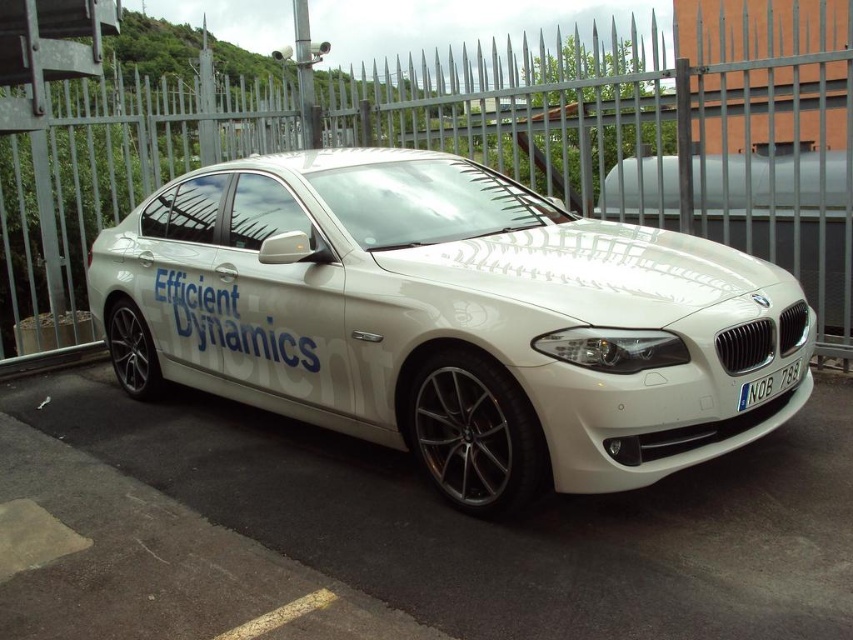
Question: Among these points, which one is nearest to the camera?

Choices:
 (A) (602, 484)
 (B) (781, 218)

Answer: (A)

Question: Is metallic silver fence at center thinner than blue metallic license plate at front?

Choices:
 (A) no
 (B) yes

Answer: (B)

Question: Does white glossy car at center have a lesser width compared to metallic silver fence at center?

Choices:
 (A) yes
 (B) no

Answer: (B)

Question: Which point appears farthest from the camera in this image?

Choices:
 (A) (1, 250)
 (B) (743, 400)

Answer: (A)

Question: Which point appears closest to the camera in this image?

Choices:
 (A) (744, 385)
 (B) (316, 140)

Answer: (A)

Question: Is white glossy car at center positioned behind blue metallic license plate at front?

Choices:
 (A) yes
 (B) no

Answer: (B)